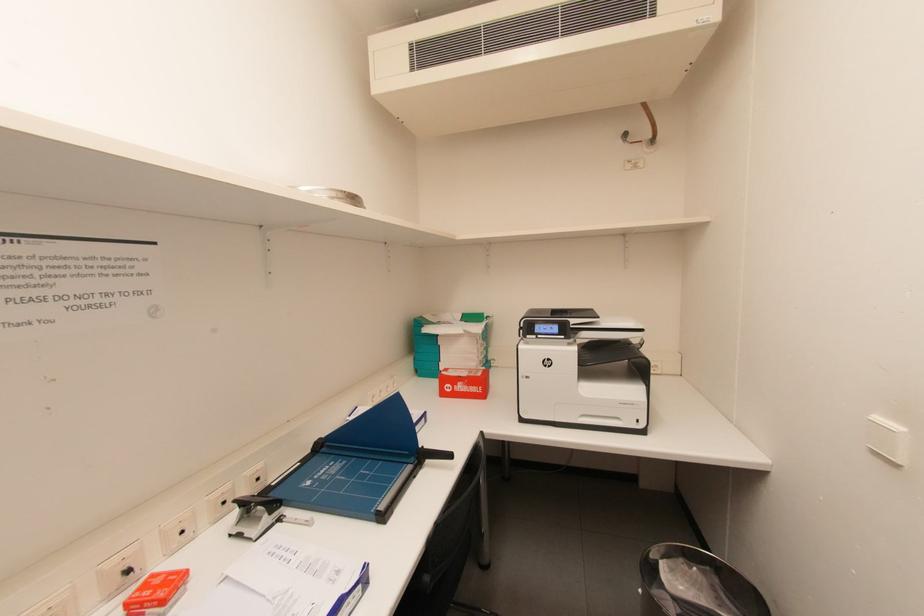
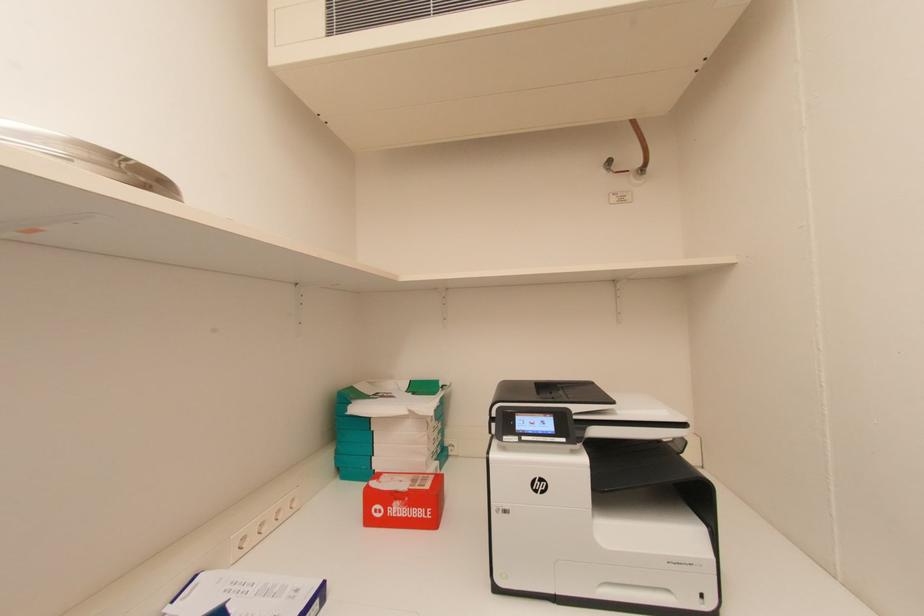
Question: In a continuous first-person perspective shot, in which direction is the camera moving?

Choices:
 (A) Left
 (B) Right
 (C) Forward
 (D) Backward

Answer: (C)